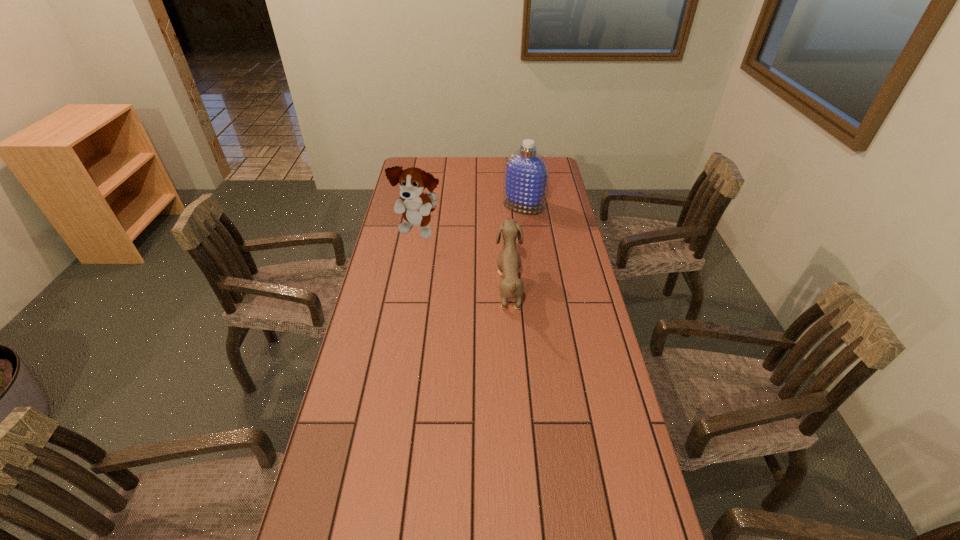
Locate an element on the screen. vacant space that's between the cleansing agent and the left puppy is located at coordinates (471, 219).

Where is `free space between the shorter puppy and the taller puppy`? free space between the shorter puppy and the taller puppy is located at coordinates (464, 259).

Where is `vacant area that lies between the taller puppy and the cleansing agent`? This screenshot has width=960, height=540. vacant area that lies between the taller puppy and the cleansing agent is located at coordinates (471, 219).

Where is `vacant point located between the farthest object and the second nearest object`? The height and width of the screenshot is (540, 960). vacant point located between the farthest object and the second nearest object is located at coordinates (471, 219).

Where is `free point between the leftmost object and the farthest object`? Image resolution: width=960 pixels, height=540 pixels. free point between the leftmost object and the farthest object is located at coordinates (471, 219).

Locate which object ranks in proximity to the farthest object. Please provide its 2D coordinates. Your answer should be formatted as a tuple, i.e. [(x, y)], where the tuple contains the x and y coordinates of a point satisfying the conditions above.

[(416, 206)]

Find the location of a particular element. object that is the second closest one to the farther puppy is located at coordinates (526, 174).